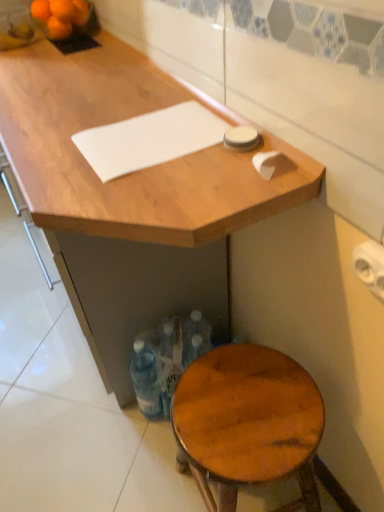
This screenshot has height=512, width=384. What are the coordinates of `free space in front of translucent plastic bottles at lower center` in the screenshot? It's located at (158, 463).